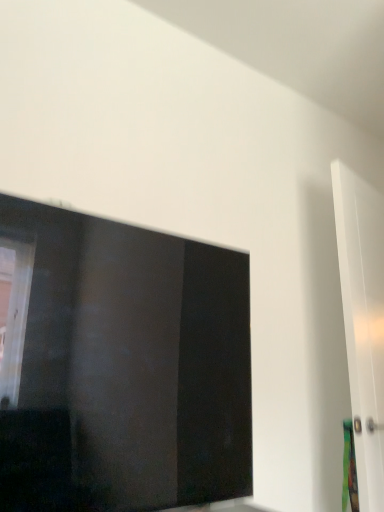
Question: Can you confirm if transparent glass window at upper left is shorter than white glossy door at right?

Choices:
 (A) yes
 (B) no

Answer: (A)

Question: Is there a large distance between transparent glass window at upper left and white glossy door at right?

Choices:
 (A) yes
 (B) no

Answer: (B)

Question: From a real-world perspective, does transparent glass window at upper left sit lower than white glossy door at right?

Choices:
 (A) no
 (B) yes

Answer: (B)

Question: Does transparent glass window at upper left have a greater width compared to white glossy door at right?

Choices:
 (A) yes
 (B) no

Answer: (A)

Question: Can you confirm if transparent glass window at upper left is positioned to the right of white glossy door at right?

Choices:
 (A) no
 (B) yes

Answer: (A)

Question: From the image's perspective, is transparent glass window at upper left located above white glossy door at right?

Choices:
 (A) yes
 (B) no

Answer: (A)

Question: Is white glossy door at right positioned with its back to transparent glass window at upper left?

Choices:
 (A) no
 (B) yes

Answer: (A)

Question: Considering the relative positions of white glossy door at right and transparent glass window at upper left in the image provided, is white glossy door at right to the right of transparent glass window at upper left from the viewer's perspective?

Choices:
 (A) no
 (B) yes

Answer: (B)

Question: Is white glossy door at right further to camera compared to transparent glass window at upper left?

Choices:
 (A) no
 (B) yes

Answer: (B)

Question: Considering the relative sizes of white glossy door at right and transparent glass window at upper left in the image provided, is white glossy door at right thinner than transparent glass window at upper left?

Choices:
 (A) yes
 (B) no

Answer: (A)

Question: From the image's perspective, is white glossy door at right below transparent glass window at upper left?

Choices:
 (A) yes
 (B) no

Answer: (A)

Question: Does white glossy door at right touch transparent glass window at upper left?

Choices:
 (A) yes
 (B) no

Answer: (B)

Question: In terms of size, does transparent glass window at upper left appear bigger or smaller than white glossy door at right?

Choices:
 (A) small
 (B) big

Answer: (B)